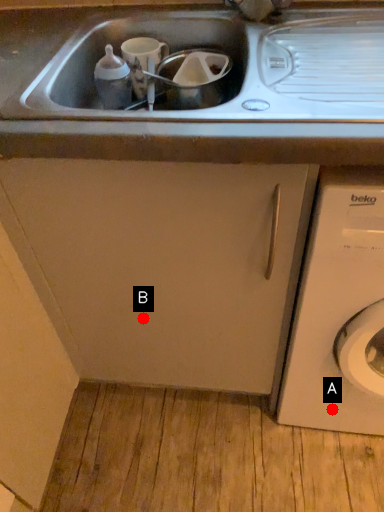
Question: Two points are circled on the image, labeled by A and B beside each circle. Which point appears closest to the camera in this image?

Choices:
 (A) A is closer
 (B) B is closer

Answer: (B)